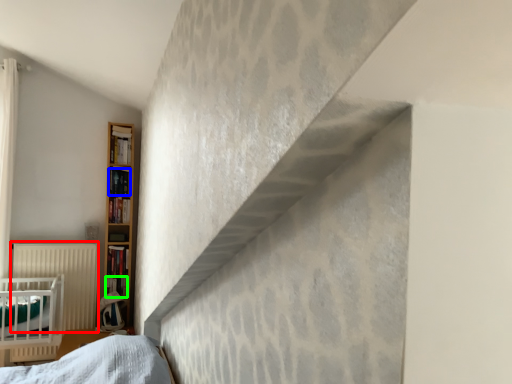
Question: Which is farther away from radiator (highlighted by a red box)? book (highlighted by a blue box) or book (highlighted by a green box)?

Choices:
 (A) book
 (B) book

Answer: (A)